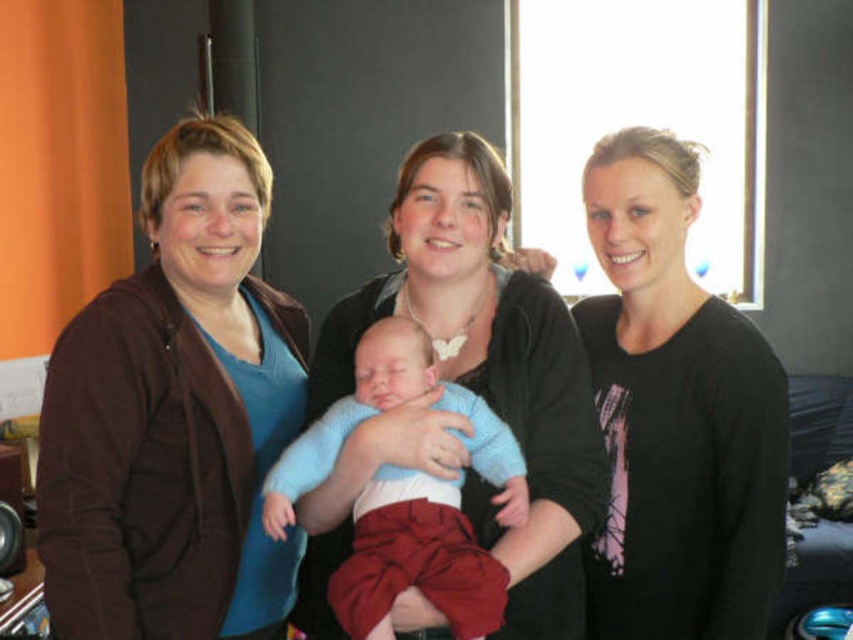
You are standing in a living room and see the brown fleece jacket at left and the knitted blue sweater at center. Which one is higher up in the image?

The brown fleece jacket at left is located above the knitted blue sweater at center in the image.

You are a photographer setting up for a family photo. You need to position a light source so it illuminates both the matte black sweater at center and the knitted blue sweater at center equally. Considering their heights, which sweater should the light be angled towards?

The matte black sweater at center is taller than the knitted blue sweater at center. To ensure both are equally illuminated, the light should be angled towards the taller matte black sweater at center so that the light reaches both sweaters appropriately.